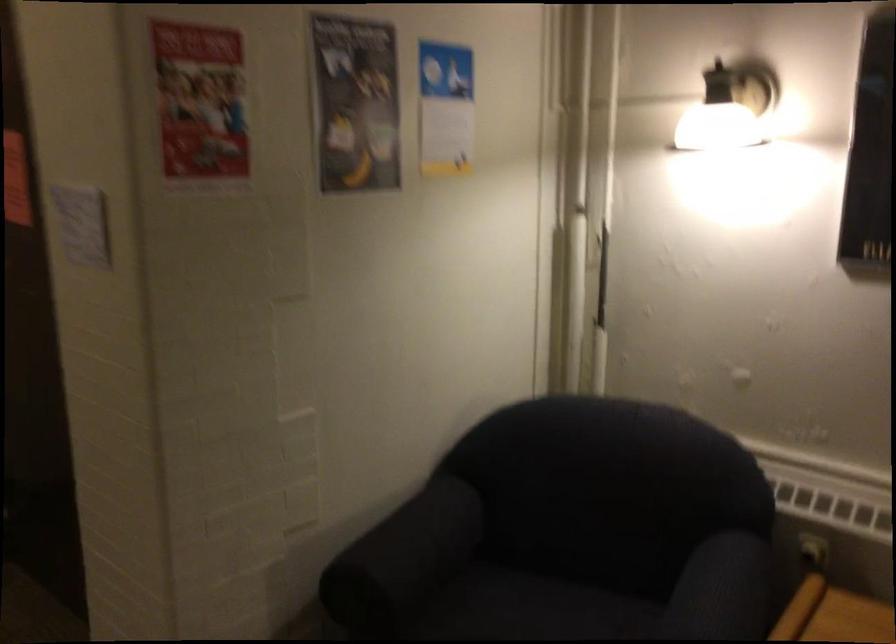
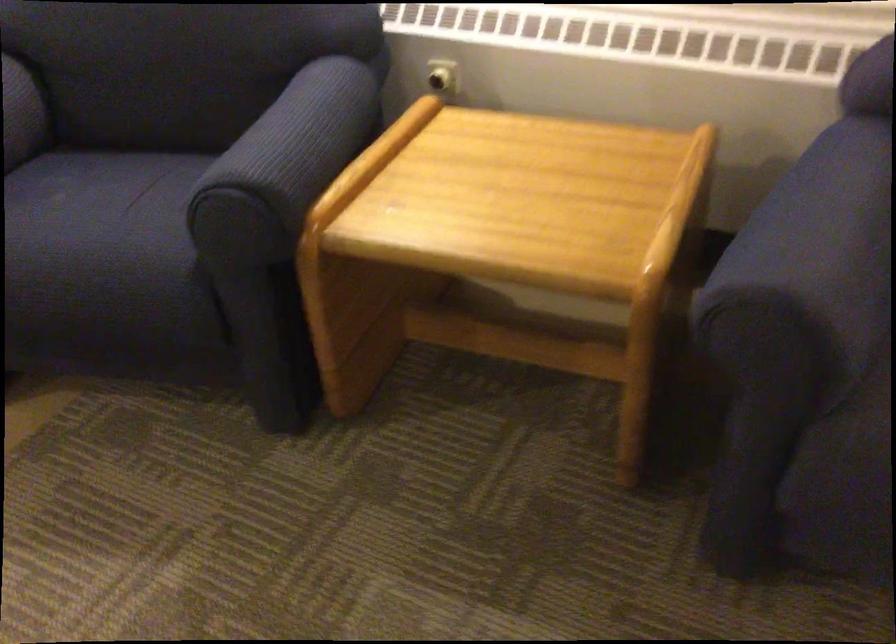
Question: The images are taken continuously from a first-person perspective. In which direction are you moving?

Choices:
 (A) Left
 (B) Right
 (C) Forward
 (D) Backward

Answer: (B)